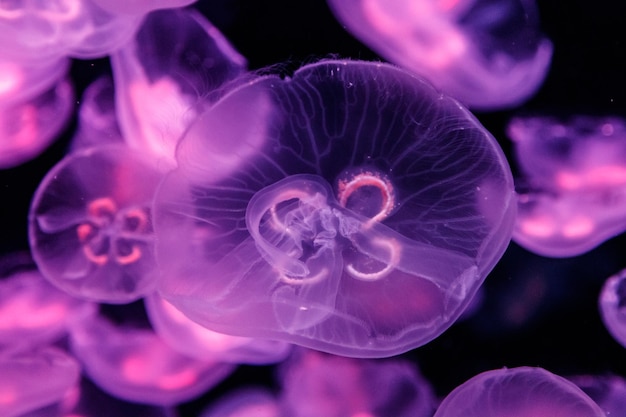
You are a GUI agent. You are given a task and a screenshot of the screen. Output one action in this format:
    pyautogui.click(x=<x>, y=<y>)
    Task: Click on the purple light
    The width and height of the screenshot is (626, 417).
    Given the screenshot: What is the action you would take?
    pyautogui.click(x=414, y=19)